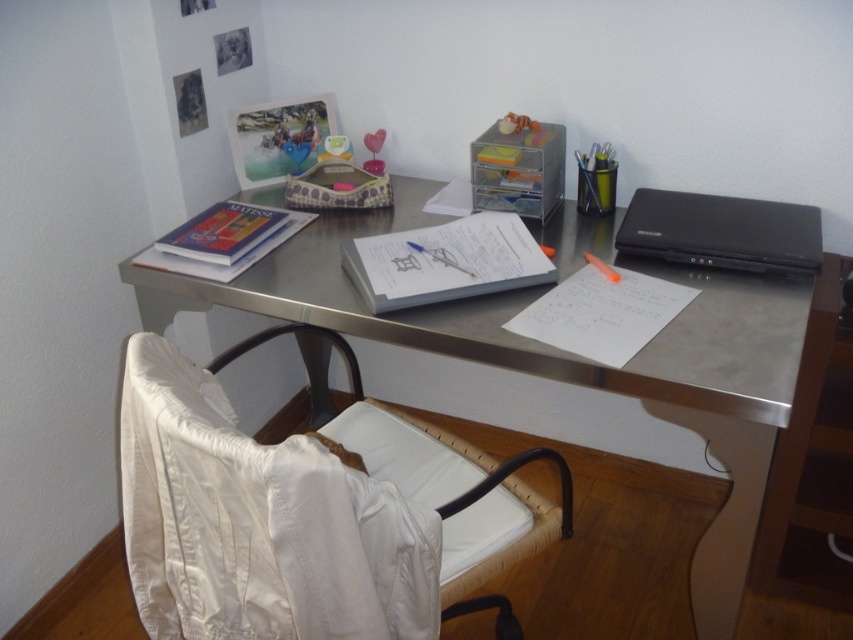
Does white fabric swivel chair at lower left come behind white paper at center?

That is False.

Can you confirm if white fabric swivel chair at lower left is wider than white paper at center?

Indeed, white fabric swivel chair at lower left has a greater width compared to white paper at center.

Who is more distant from viewer, (184, 387) or (422, 248)?

The point (422, 248) is more distant.

Locate an element on the screen. The height and width of the screenshot is (640, 853). white fabric swivel chair at lower left is located at coordinates (311, 516).

Consider the image. Does metallic gray desk at center appear on the right side of hardcover book at upper left?

Indeed, metallic gray desk at center is positioned on the right side of hardcover book at upper left.

Who is more forward, (757, 456) or (244, 262)?

Point (757, 456) is in front.

Locate an element on the screen. This screenshot has height=640, width=853. metallic gray desk at center is located at coordinates (614, 381).

Can you confirm if white fabric swivel chair at lower left is taller than metallic gray desk at center?

Incorrect, white fabric swivel chair at lower left's height is not larger of metallic gray desk at center's.

Measure the distance between white fabric swivel chair at lower left and camera.

white fabric swivel chair at lower left is 34.92 inches from camera.

Between point (189, 474) and point (375, 221), which one is positioned behind?

Point (375, 221)

Image resolution: width=853 pixels, height=640 pixels. I want to click on white fabric swivel chair at lower left, so click(x=311, y=516).